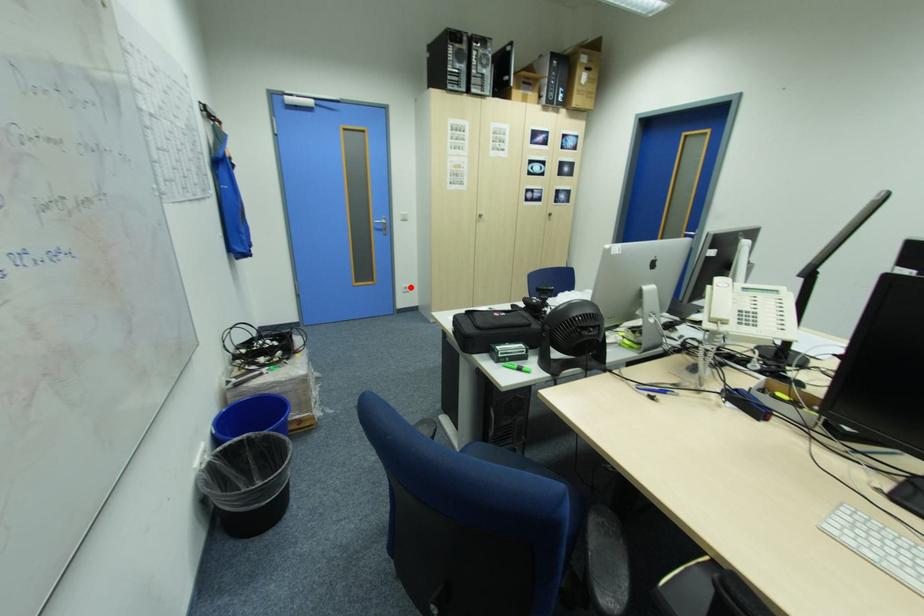
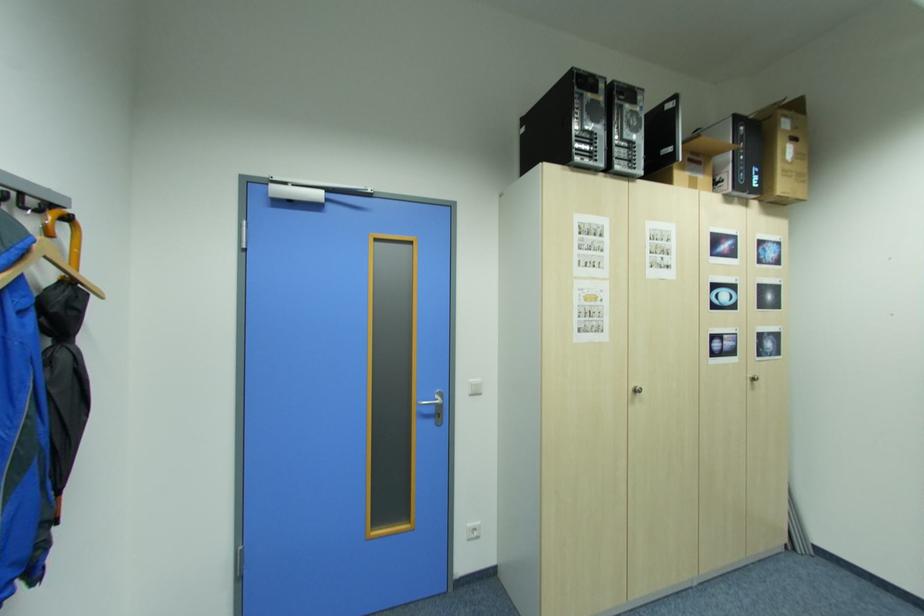
Question: A red point is marked in image1. In image2, is the corresponding 3D point closer to the camera or farther? Reply with the corresponding letter.

Choices:
 (A) The corresponding 3D point is closer.
 (B) The corresponding 3D point is farther.

Answer: (A)